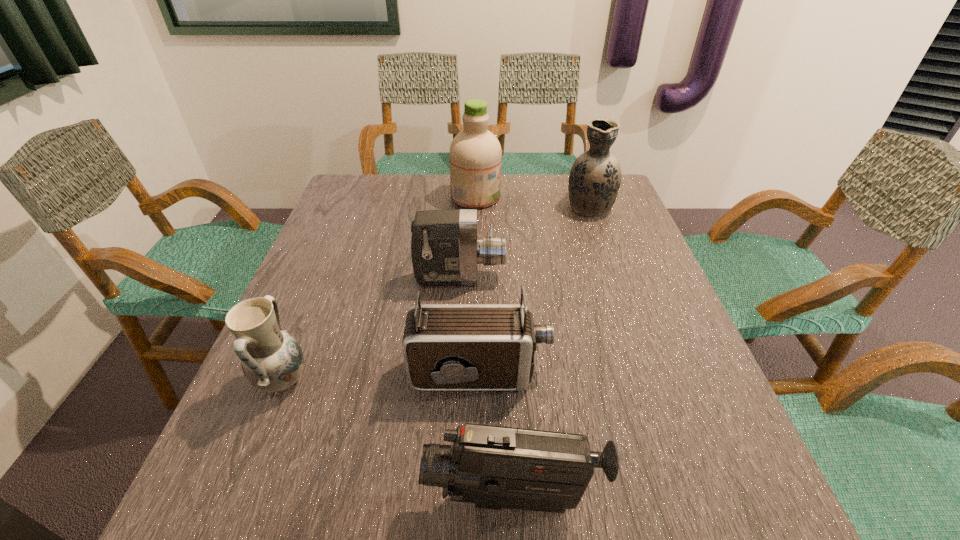
Where is `vacant position at the near edge of the desktop`? The width and height of the screenshot is (960, 540). vacant position at the near edge of the desktop is located at coordinates coord(307,490).

I want to click on free space at the left edge, so click(295, 400).

This screenshot has height=540, width=960. I want to click on free space at the right edge, so click(x=601, y=245).

This screenshot has width=960, height=540. In order to click on vacant space at the far left corner in this screenshot , I will do `click(369, 199)`.

You are a GUI agent. You are given a task and a screenshot of the screen. Output one action in this format:
    pyautogui.click(x=<x>, y=<y>)
    Task: Click on the empty location between the cleansing agent and the second farthest camcorder
    This screenshot has height=540, width=960.
    Given the screenshot: What is the action you would take?
    pyautogui.click(x=478, y=285)

Where is `empty space that is in between the cleansing agent and the leftmost object`? This screenshot has height=540, width=960. empty space that is in between the cleansing agent and the leftmost object is located at coordinates (379, 289).

Where is `vacant area between the vase and the farthest camcorder`? This screenshot has height=540, width=960. vacant area between the vase and the farthest camcorder is located at coordinates (525, 241).

The image size is (960, 540). What are the coordinates of `free space that is in between the farthest camcorder and the vase` in the screenshot? It's located at (525, 241).

Locate an element on the screen. This screenshot has height=540, width=960. vacant point located between the second nearest camcorder and the leftmost object is located at coordinates (381, 377).

Identify the location of free space between the leftmost object and the cleansing agent. (379, 289).